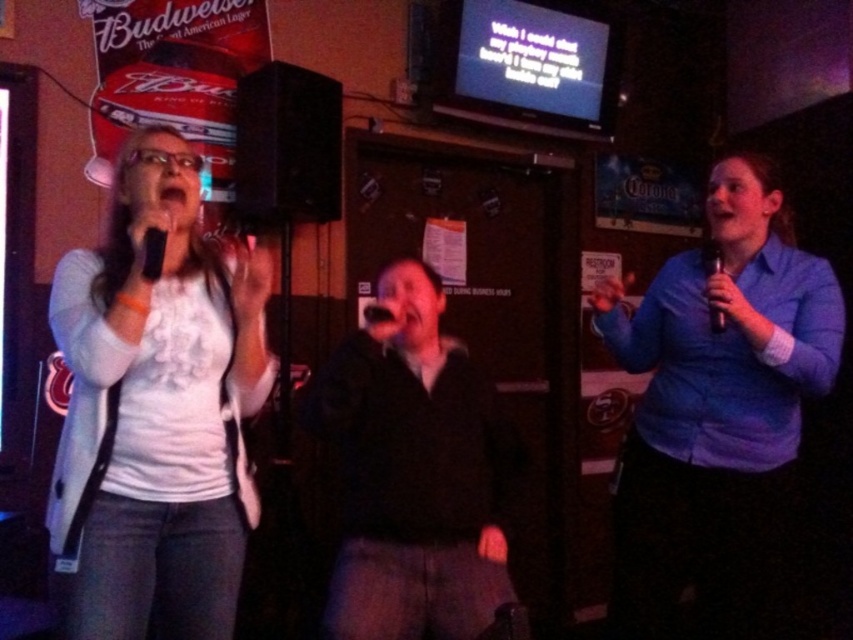
Question: Among these points, which one is nearest to the camera?

Choices:
 (A) (328, 417)
 (B) (157, 227)
 (C) (718, 250)
 (D) (775, 189)

Answer: (B)

Question: Which point is closer to the camera taking this photo?

Choices:
 (A) (448, 554)
 (B) (372, 308)
 (C) (734, 404)
 (D) (154, 269)

Answer: (D)

Question: Which is nearer to the white matte shirt at left?

Choices:
 (A) black matte microphone at left
 (B) blue shirt at right
 (C) black matte microphone at right

Answer: (A)

Question: Can you confirm if white matte shirt at left is positioned below blue shirt at right?

Choices:
 (A) no
 (B) yes

Answer: (A)

Question: Is white matte shirt at left bigger than black matte microphone at left?

Choices:
 (A) no
 (B) yes

Answer: (B)

Question: Does blue shirt at right have a lesser width compared to black matte microphone at center?

Choices:
 (A) yes
 (B) no

Answer: (B)